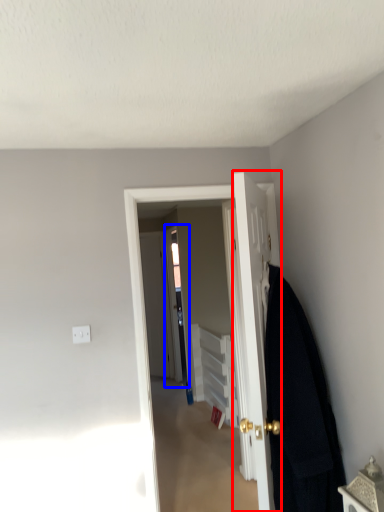
Question: Which object is closer to the camera taking this photo, door (highlighted by a red box) or screen door (highlighted by a blue box)?

Choices:
 (A) door
 (B) screen door

Answer: (A)